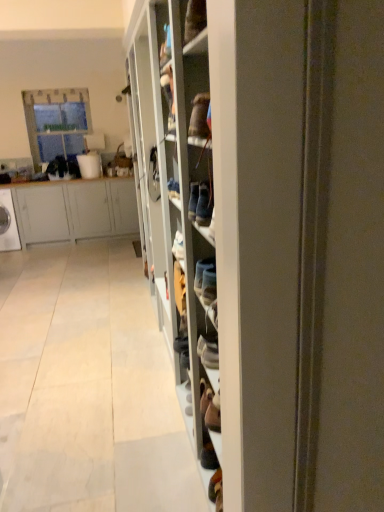
Question: Looking at their shapes, would you say wooden shoe rack at center is wider or thinner than matte gray cabinet at left?

Choices:
 (A) thin
 (B) wide

Answer: (A)

Question: Relative to matte gray cabinet at left, is wooden shoe rack at center in front or behind?

Choices:
 (A) front
 (B) behind

Answer: (A)

Question: Based on their relative distances, which object is nearer to the matte gray cabinet at left?

Choices:
 (A) wooden shoe rack at center
 (B) clear glass window at upper left
 (C) white glossy washing machine at left

Answer: (C)

Question: Which object is positioned farthest from the wooden shoe rack at center?

Choices:
 (A) white glossy washing machine at left
 (B) clear glass window at upper left
 (C) matte gray cabinet at left

Answer: (A)